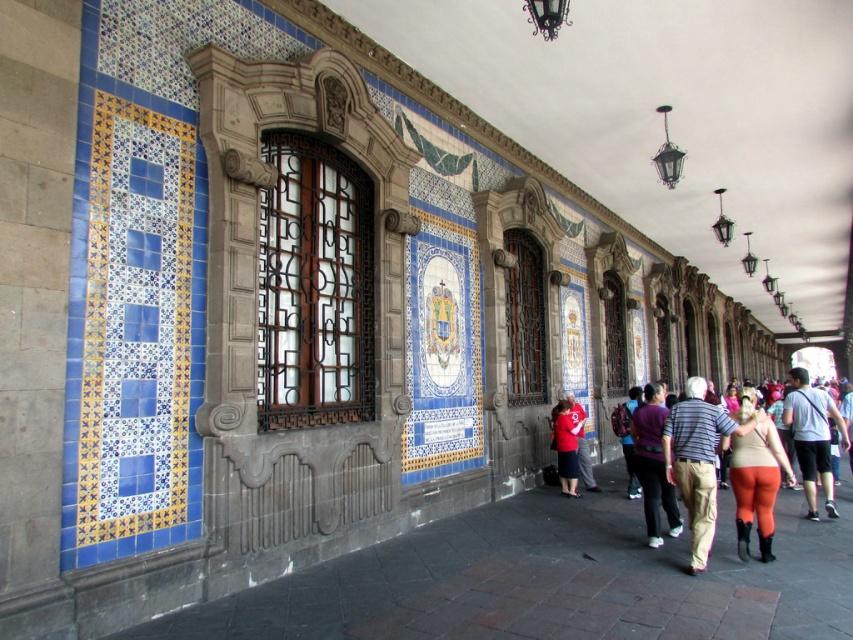
You are standing in front of the historic building and see the purple fabric at center and the matte red shirt at center. Which object is positioned to the right of the other?

The purple fabric at center is to the right of the matte red shirt at center.

You are an architect examining the historic building. You notice the brown wooden window at center and the matte beige leggings at center right. Which object occupies a larger area in the scene?

The brown wooden window at center is bigger than the matte beige leggings at center right, so the brown wooden window at center occupies a larger area in the scene.